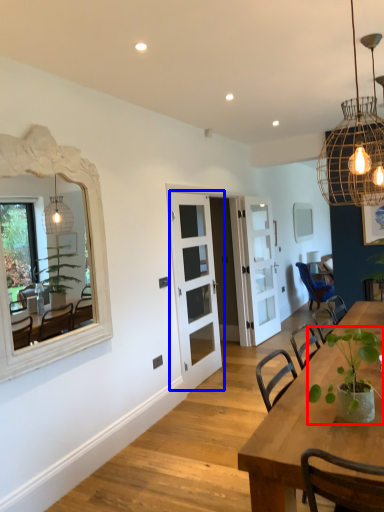
Question: Which object appears farthest to the camera in this image, houseplant (highlighted by a red box) or door (highlighted by a blue box)?

Choices:
 (A) houseplant
 (B) door

Answer: (B)